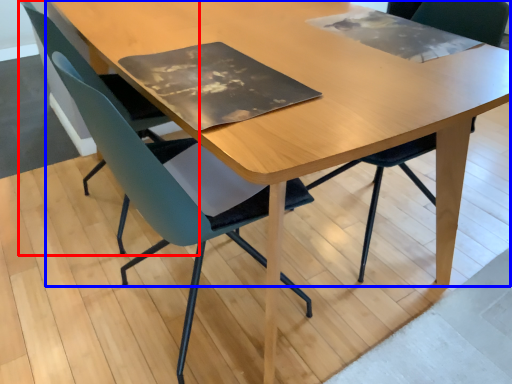
Question: Which point is further to the camera, chair (highlighted by a red box) or table (highlighted by a blue box)?

Choices:
 (A) chair
 (B) table

Answer: (A)